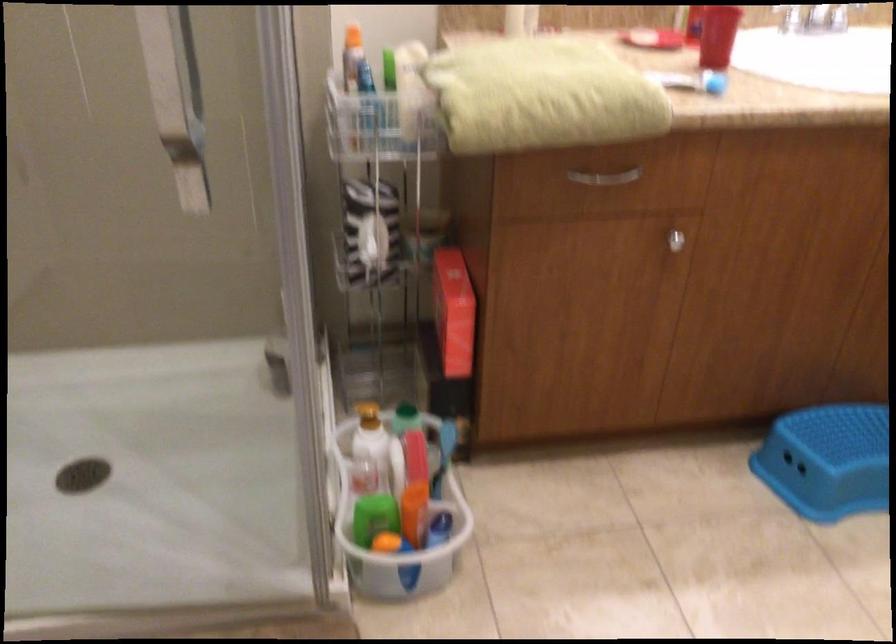
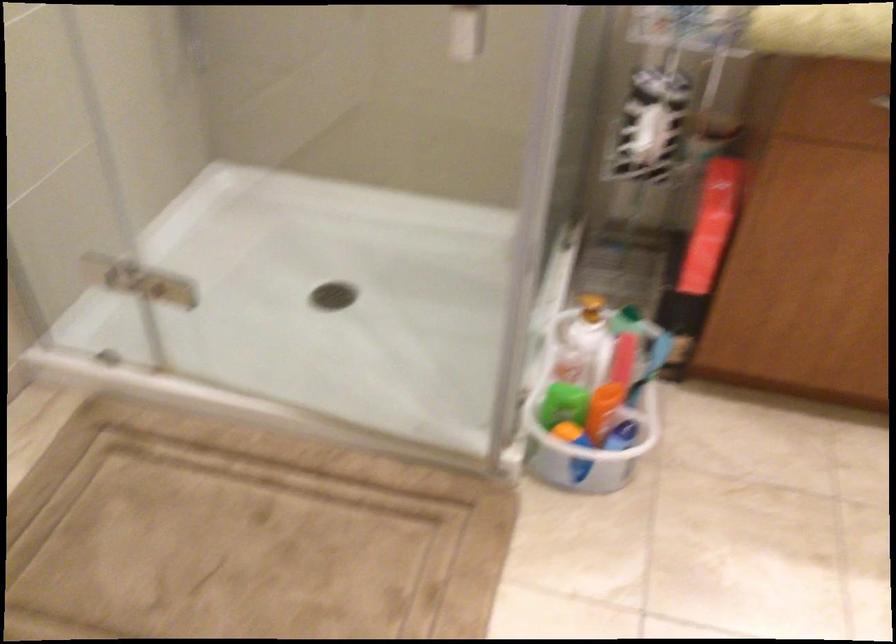
In the second image, find the point that corresponds to point 406,507 in the first image.

(595, 397)